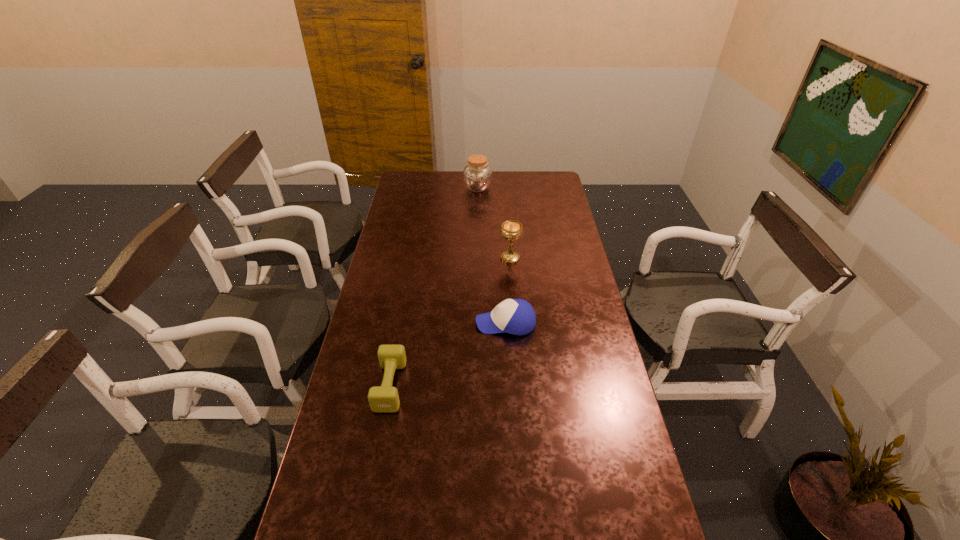
What are the coordinates of `vacant space located on the right of the leftmost object` in the screenshot? It's located at (497, 386).

In order to click on object that is at the far edge in this screenshot , I will do `click(477, 175)`.

Identify the location of object located in the left edge section of the desktop. The image size is (960, 540). (382, 399).

You are a GUI agent. You are given a task and a screenshot of the screen. Output one action in this format:
    pyautogui.click(x=<x>, y=<y>)
    Task: Click on the blank space at the left edge of the desktop
    This screenshot has width=960, height=540.
    Given the screenshot: What is the action you would take?
    pyautogui.click(x=362, y=339)

In the image, there is a desktop. Where is `blank space at the right edge`? This screenshot has width=960, height=540. blank space at the right edge is located at coordinates (561, 247).

I want to click on vacant space at the far left corner of the desktop, so click(428, 188).

Locate an element on the screen. free space at the far right corner is located at coordinates point(552,175).

Locate an element on the screen. This screenshot has width=960, height=540. free space between the jar and the third farthest object is located at coordinates (492, 255).

The image size is (960, 540). I want to click on vacant area that lies between the leftmost object and the farthest object, so click(x=434, y=287).

Locate an element on the screen. This screenshot has height=540, width=960. blank region between the second farthest object and the farthest object is located at coordinates (493, 223).